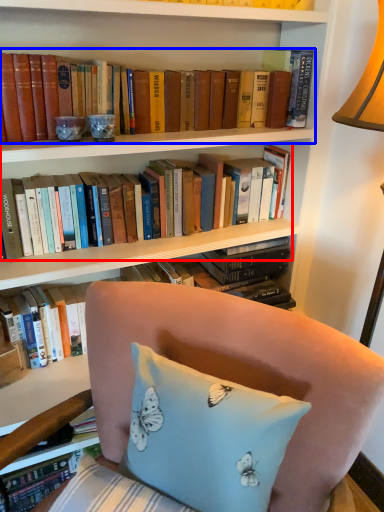
Question: Which object is closer to the camera taking this photo, book (highlighted by a red box) or book (highlighted by a blue box)?

Choices:
 (A) book
 (B) book

Answer: (B)